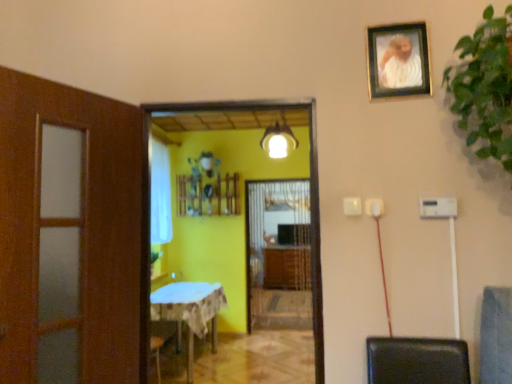
Question: Considering the relative sizes of green leafy plant at upper right and white sheer curtain at left in the image provided, is green leafy plant at upper right shorter than white sheer curtain at left?

Choices:
 (A) no
 (B) yes

Answer: (B)

Question: Is green leafy plant at upper right located outside white sheer curtain at left?

Choices:
 (A) yes
 (B) no

Answer: (A)

Question: Considering the relative positions of green leafy plant at upper right and white sheer curtain at left in the image provided, is green leafy plant at upper right to the right of white sheer curtain at left from the viewer's perspective?

Choices:
 (A) no
 (B) yes

Answer: (B)

Question: Considering the relative sizes of green leafy plant at upper right and white sheer curtain at left in the image provided, is green leafy plant at upper right wider than white sheer curtain at left?

Choices:
 (A) no
 (B) yes

Answer: (B)

Question: Does green leafy plant at upper right appear on the left side of white sheer curtain at left?

Choices:
 (A) yes
 (B) no

Answer: (B)

Question: Considering the positions of wooden cabinet at center and white sheer curtain at left in the image, is wooden cabinet at center taller or shorter than white sheer curtain at left?

Choices:
 (A) tall
 (B) short

Answer: (B)

Question: From a real-world perspective, is wooden cabinet at center positioned above or below white sheer curtain at left?

Choices:
 (A) below
 (B) above

Answer: (A)

Question: Considering the positions of wooden cabinet at center and white sheer curtain at left in the image, is wooden cabinet at center wider or thinner than white sheer curtain at left?

Choices:
 (A) thin
 (B) wide

Answer: (B)

Question: From the image's perspective, is wooden cabinet at center positioned above or below white sheer curtain at left?

Choices:
 (A) below
 (B) above

Answer: (A)

Question: Does point (293, 266) appear closer or farther from the camera than point (280, 139)?

Choices:
 (A) farther
 (B) closer

Answer: (A)

Question: Visually, is wooden cabinet at center positioned to the left or to the right of white glossy light fixture at center?

Choices:
 (A) left
 (B) right

Answer: (B)

Question: Is wooden cabinet at center inside the boundaries of white glossy light fixture at center, or outside?

Choices:
 (A) outside
 (B) inside

Answer: (A)

Question: From a real-world perspective, is wooden cabinet at center positioned above or below white glossy light fixture at center?

Choices:
 (A) below
 (B) above

Answer: (A)

Question: From the image's perspective, is yellow matte screen door at center, which appears as the 2th screen door when viewed from the back, above or below white glossy light fixture at center?

Choices:
 (A) below
 (B) above

Answer: (A)

Question: Looking at their shapes, would you say yellow matte screen door at center, positioned as the first screen door in front-to-back order, is wider or thinner than white glossy light fixture at center?

Choices:
 (A) wide
 (B) thin

Answer: (B)